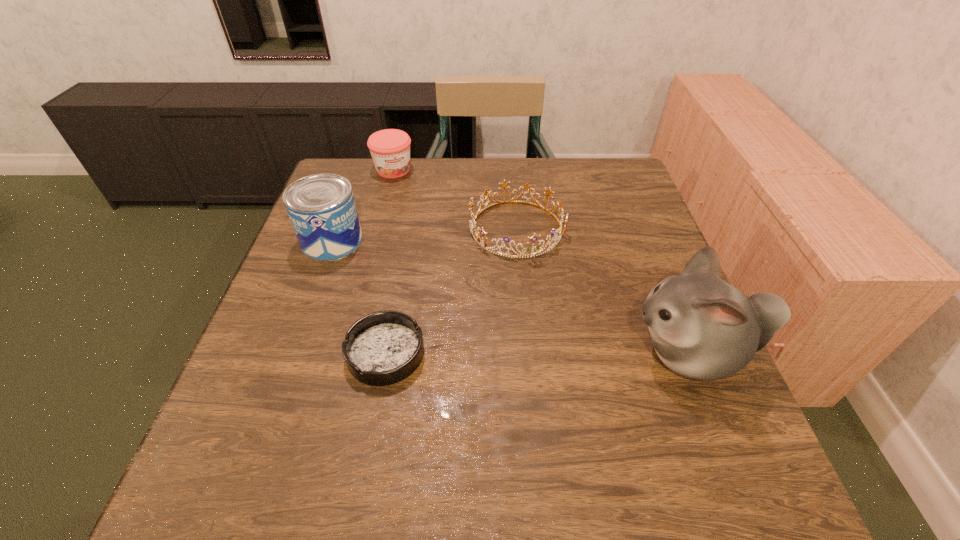
Where is `vacant area situated 0.140m on the face of the rightmost object`? This screenshot has width=960, height=540. vacant area situated 0.140m on the face of the rightmost object is located at coordinates (555, 353).

Image resolution: width=960 pixels, height=540 pixels. In order to click on free location located on the face of the rightmost object in this screenshot , I will do `click(555, 353)`.

What are the coordinates of `vacant region located 0.150m on the front-facing side of the fourth tallest object` in the screenshot? It's located at (554, 307).

In order to click on vacant point located on the front-facing side of the fourth tallest object in this screenshot , I will do `click(547, 294)`.

Locate an element on the screen. The image size is (960, 540). free space located on the front-facing side of the fourth tallest object is located at coordinates (594, 393).

Where is `free point located on the front label of the second tallest object`? free point located on the front label of the second tallest object is located at coordinates (424, 305).

Locate an element on the screen. The width and height of the screenshot is (960, 540). free space located 0.330m on the front label of the second tallest object is located at coordinates (451, 324).

Where is `vacant region located on the front label of the second tallest object`? The image size is (960, 540). vacant region located on the front label of the second tallest object is located at coordinates (381, 275).

Locate an element on the screen. Image resolution: width=960 pixels, height=540 pixels. vacant region located 0.190m on the front label of the farthest object is located at coordinates (420, 216).

Where is `free space located 0.270m on the front label of the farthest object`? The image size is (960, 540). free space located 0.270m on the front label of the farthest object is located at coordinates (431, 234).